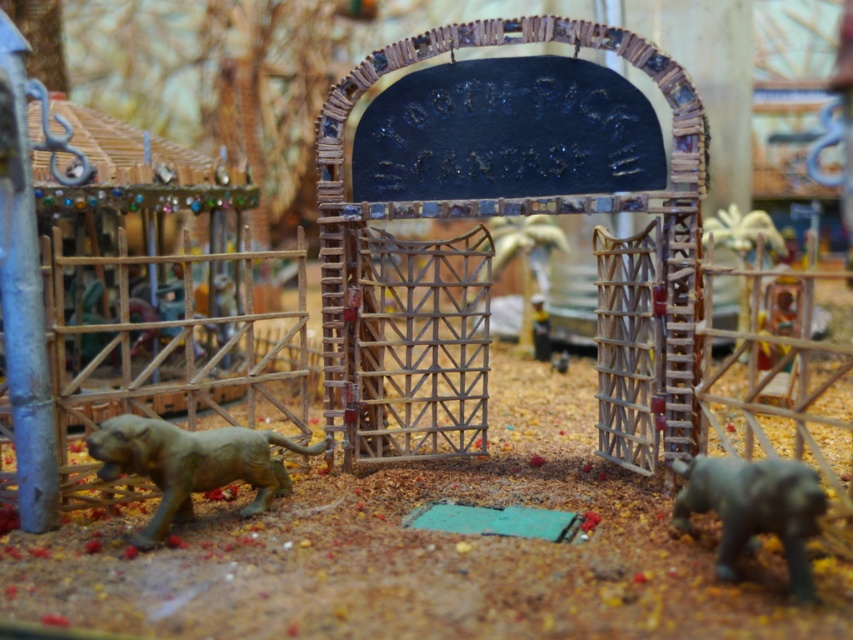
Which of these two, wooden gate at center or gray matte baby elephant at lower right, stands taller?

Standing taller between the two is wooden gate at center.

Is wooden gate at center to the right of gray matte baby elephant at lower right from the viewer's perspective?

Incorrect, wooden gate at center is not on the right side of gray matte baby elephant at lower right.

Is point (343, 406) farther from viewer compared to point (786, 476)?

That is True.

Identify the location of wooden gate at center. The width and height of the screenshot is (853, 640). (506, 218).

Is wooden gate at center shorter than gold metallic tiger at lower left?

No.

Is wooden gate at center thinner than gold metallic tiger at lower left?

No, wooden gate at center is not thinner than gold metallic tiger at lower left.

Who is more distant from viewer, (x=476, y=396) or (x=225, y=481)?

The point (x=476, y=396) is behind.

You are a GUI agent. You are given a task and a screenshot of the screen. Output one action in this format:
    pyautogui.click(x=<x>, y=<y>)
    Task: Click on the wooden gate at center
    Image resolution: width=853 pixels, height=640 pixels.
    Given the screenshot: What is the action you would take?
    pyautogui.click(x=506, y=218)

Who is lower down, gold metallic tiger at lower left or gray matte baby elephant at lower right?

gray matte baby elephant at lower right is lower down.

Looking at this image, can you confirm if gold metallic tiger at lower left is shorter than gray matte baby elephant at lower right?

In fact, gold metallic tiger at lower left may be taller than gray matte baby elephant at lower right.

At what (x,y) coordinates should I click in order to perform the action: click on gold metallic tiger at lower left. Please return your answer as a coordinate pair (x, y). The width and height of the screenshot is (853, 640). Looking at the image, I should click on (190, 465).